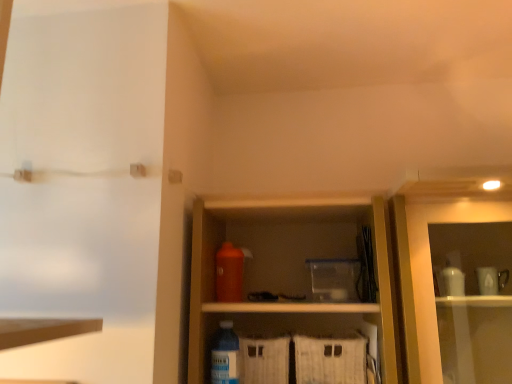
Question: Can you confirm if orange matte bottle at center, the 1th bottle when ordered from top to bottom, is shorter than transparent plastic screen door at upper left?

Choices:
 (A) no
 (B) yes

Answer: (B)

Question: Is orange matte bottle at center, which is the 2th bottle in front-to-back order, next to transparent plastic screen door at upper left?

Choices:
 (A) no
 (B) yes

Answer: (A)

Question: Is orange matte bottle at center, the 1th bottle positioned from the back, at the right side of transparent plastic screen door at upper left?

Choices:
 (A) yes
 (B) no

Answer: (A)

Question: From a real-world perspective, is orange matte bottle at center, the 1th bottle positioned from the back, located higher than transparent plastic screen door at upper left?

Choices:
 (A) yes
 (B) no

Answer: (B)

Question: Considering the relative sizes of orange matte bottle at center, which is the 2th bottle in front-to-back order, and transparent plastic screen door at upper left in the image provided, is orange matte bottle at center, which is the 2th bottle in front-to-back order, thinner than transparent plastic screen door at upper left?

Choices:
 (A) no
 (B) yes

Answer: (B)

Question: From the image's perspective, is transparent plastic screen door at upper left located above or below orange matte bottle at center, the second bottle positioned from the bottom?

Choices:
 (A) above
 (B) below

Answer: (A)

Question: In the image, is transparent plastic screen door at upper left on the left side or the right side of orange matte bottle at center, the 1th bottle positioned from the back?

Choices:
 (A) right
 (B) left

Answer: (B)

Question: From their relative heights in the image, would you say transparent plastic screen door at upper left is taller or shorter than orange matte bottle at center, which is the 2th bottle in front-to-back order?

Choices:
 (A) short
 (B) tall

Answer: (B)

Question: Does point (160, 110) appear closer or farther from the camera than point (241, 268)?

Choices:
 (A) closer
 (B) farther

Answer: (A)

Question: Is translucent plastic bottle at lower center, the 2th bottle viewed from the back, bigger or smaller than transparent plastic screen door at upper left?

Choices:
 (A) big
 (B) small

Answer: (B)

Question: Visually, is translucent plastic bottle at lower center, which ranks as the 1th bottle in bottom-to-top order, positioned to the left or to the right of transparent plastic screen door at upper left?

Choices:
 (A) left
 (B) right

Answer: (B)

Question: Considering the positions of translucent plastic bottle at lower center, the 2th bottle from the top, and transparent plastic screen door at upper left in the image, is translucent plastic bottle at lower center, the 2th bottle from the top, taller or shorter than transparent plastic screen door at upper left?

Choices:
 (A) tall
 (B) short

Answer: (B)

Question: Is translucent plastic bottle at lower center, the 2th bottle from the top, in front of or behind transparent plastic screen door at upper left in the image?

Choices:
 (A) front
 (B) behind

Answer: (B)

Question: Is transparent plastic screen door at upper left in front of or behind translucent plastic bottle at lower center, the 2th bottle viewed from the back, in the image?

Choices:
 (A) front
 (B) behind

Answer: (A)

Question: Looking at the image, does transparent plastic screen door at upper left seem bigger or smaller compared to translucent plastic bottle at lower center, which ranks as the 1th bottle in bottom-to-top order?

Choices:
 (A) small
 (B) big

Answer: (B)